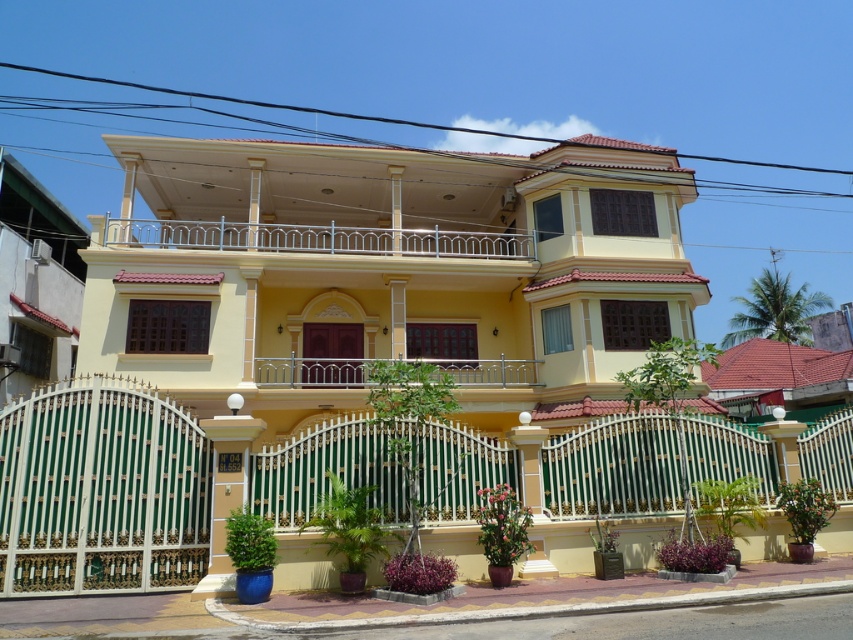
Does green wrought iron fence at center have a greater height compared to silver metallic balcony at center?

Correct, green wrought iron fence at center is much taller as silver metallic balcony at center.

Is the position of green wrought iron fence at center less distant than that of silver metallic balcony at center?

Yes, it is.

The image size is (853, 640). What do you see at coordinates (102, 490) in the screenshot?
I see `green wrought iron fence at center` at bounding box center [102, 490].

At what (x,y) coordinates should I click in order to perform the action: click on green wrought iron fence at center. Please return your answer as a coordinate pair (x, y). Looking at the image, I should click on (102, 490).